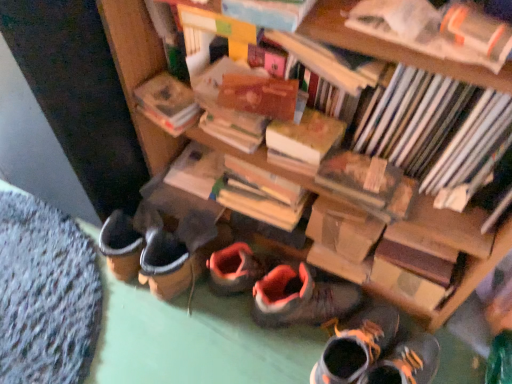
You are a GUI agent. You are given a task and a screenshot of the screen. Output one action in this format:
    pyautogui.click(x=<x>, y=<y>)
    Task: Click on the vacant space situated above hardcover book at center, which is counted as the 1th book, starting from the back (from a real-world perspective)
    The width and height of the screenshot is (512, 384).
    Given the screenshot: What is the action you would take?
    (197, 164)